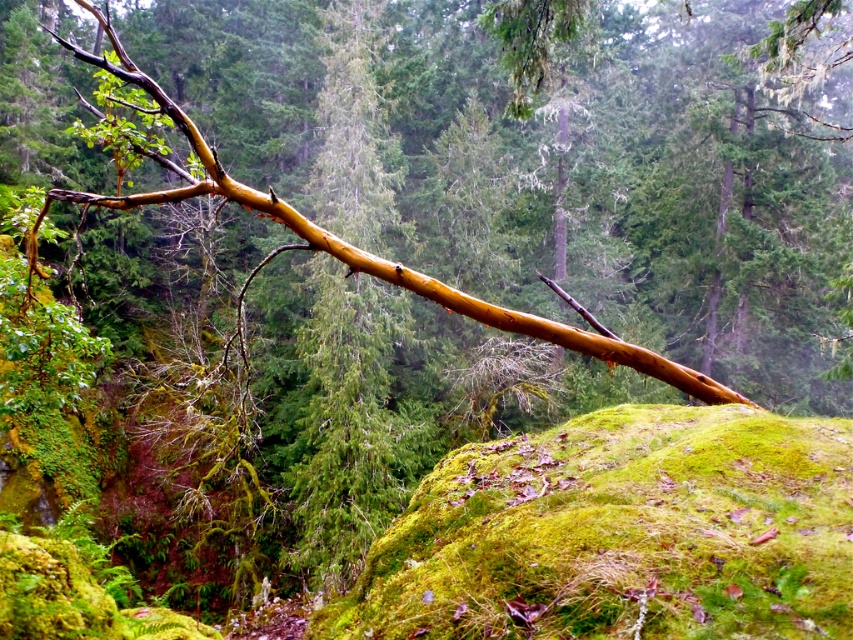
Can you confirm if green mossy rock at center is shorter than glossy brown branch at upper center?

Indeed, green mossy rock at center has a lesser height compared to glossy brown branch at upper center.

Is point (560, 604) farther from camera compared to point (181, 122)?

No, (560, 604) is closer to viewer.

Where is `green mossy rock at center`? The image size is (853, 640). green mossy rock at center is located at coordinates (621, 532).